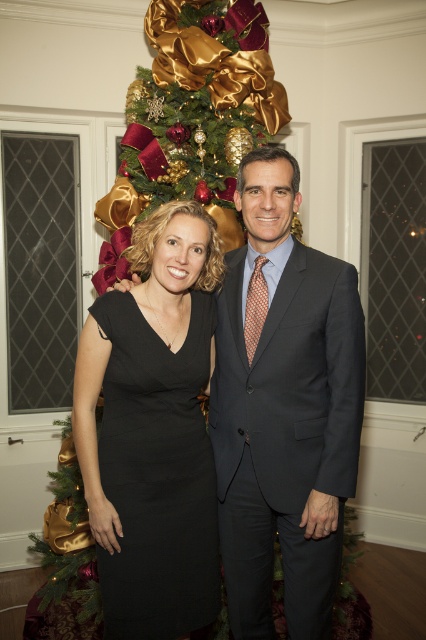
Question: Can you confirm if dark gray suit at center is bigger than shiny gold ornaments at center?

Choices:
 (A) yes
 (B) no

Answer: (B)

Question: Is dark gray suit at center to the right of black satin dress at center from the viewer's perspective?

Choices:
 (A) yes
 (B) no

Answer: (A)

Question: Which point is farther from the camera taking this photo?

Choices:
 (A) [x=126, y=328]
 (B) [x=184, y=109]
 (C) [x=296, y=529]

Answer: (B)

Question: Among these points, which one is nearest to the camera?

Choices:
 (A) (164, 74)
 (B) (126, 589)
 (C) (279, 396)

Answer: (B)

Question: Considering the real-world distances, which object is closest to the black satin dress at center?

Choices:
 (A) dark gray suit at center
 (B) shiny gold ornaments at center

Answer: (A)

Question: Is dark gray suit at center closer to the viewer compared to black satin dress at center?

Choices:
 (A) no
 (B) yes

Answer: (B)